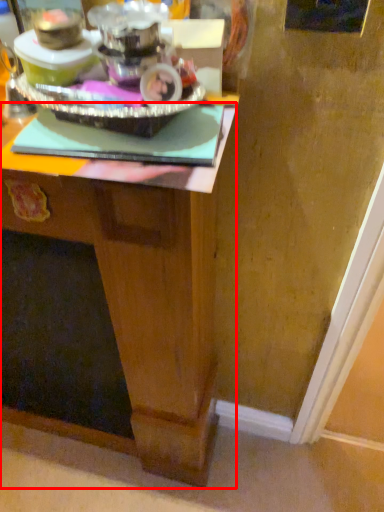
Question: From the image's perspective, what is the correct spatial relationship of desk (annotated by the red box) in relation to appliance?

Choices:
 (A) above
 (B) below

Answer: (B)